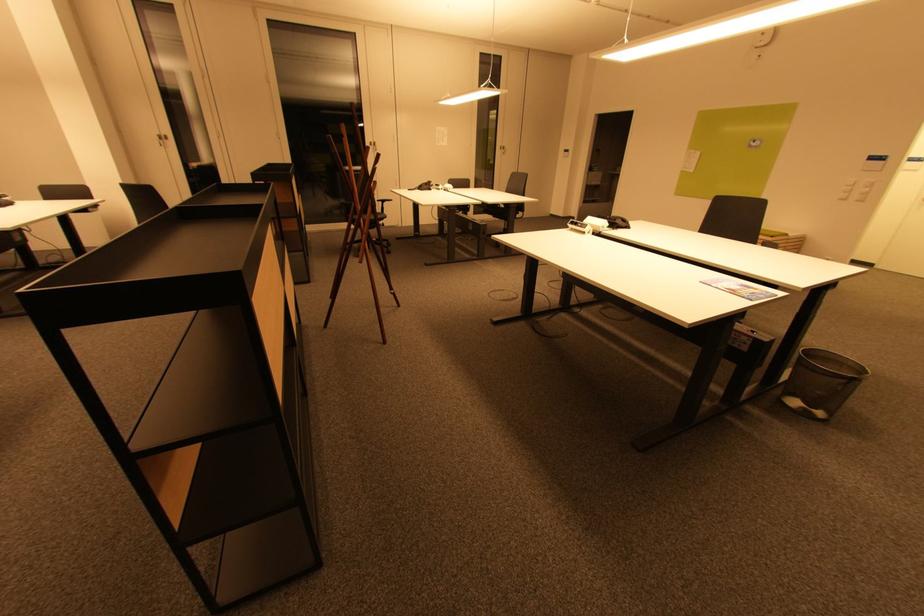
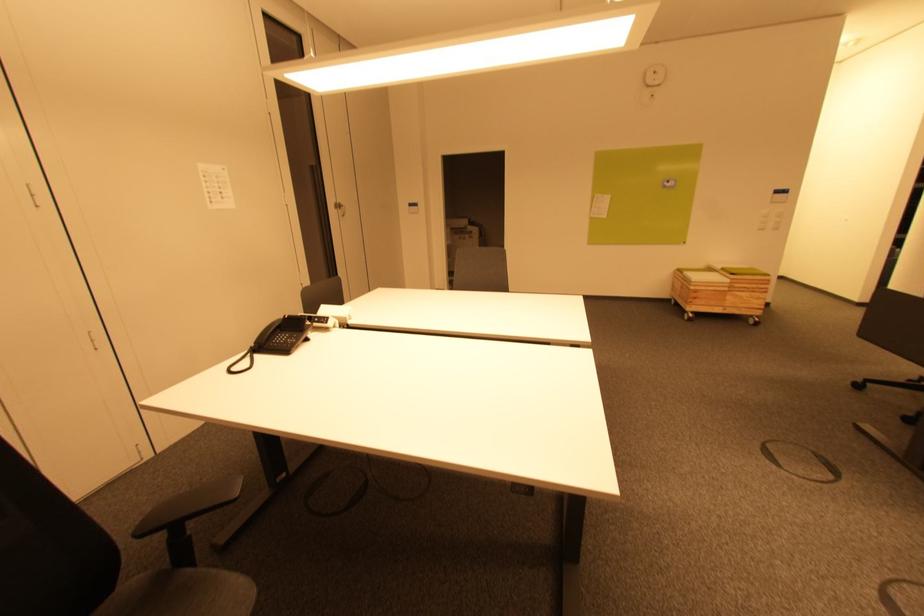
Find the pixel in the second image that matches (760,50) in the first image.

(652, 87)